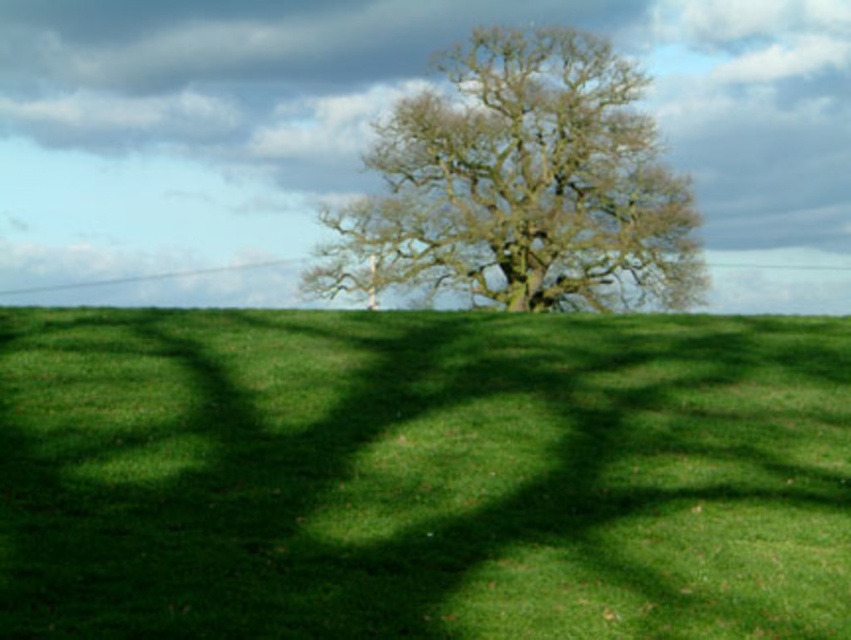
Question: Which point is closer to the camera?

Choices:
 (A) (490, 125)
 (B) (100, 580)

Answer: (B)

Question: Does green grass at center appear under green leafy tree at center?

Choices:
 (A) no
 (B) yes

Answer: (B)

Question: Among these points, which one is nearest to the camera?

Choices:
 (A) (443, 570)
 (B) (614, 132)

Answer: (A)

Question: Can you confirm if green grass at center is positioned to the left of green leafy tree at center?

Choices:
 (A) no
 (B) yes

Answer: (B)

Question: Which object appears farthest from the camera in this image?

Choices:
 (A) green grass at center
 (B) green leafy tree at center

Answer: (B)

Question: Considering the relative positions of green grass at center and green leafy tree at center in the image provided, where is green grass at center located with respect to green leafy tree at center?

Choices:
 (A) below
 (B) above

Answer: (A)